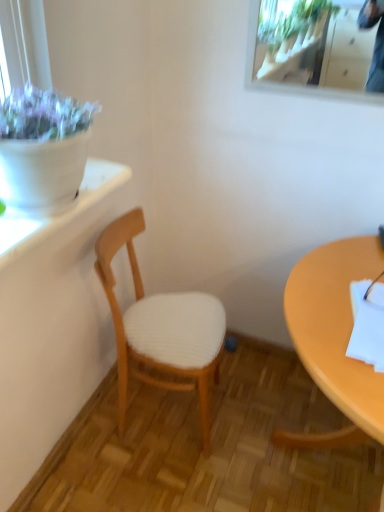
Identify the location of free space to the left of matte yellow desk at right. (182, 460).